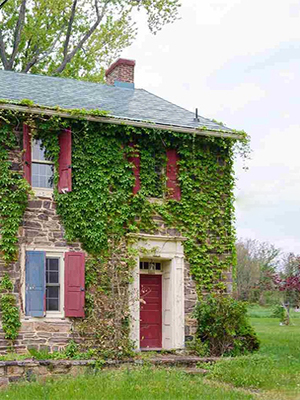
Image resolution: width=300 pixels, height=400 pixels. In order to click on windows in this screenshot , I will do `click(156, 171)`, `click(48, 301)`, `click(44, 151)`.